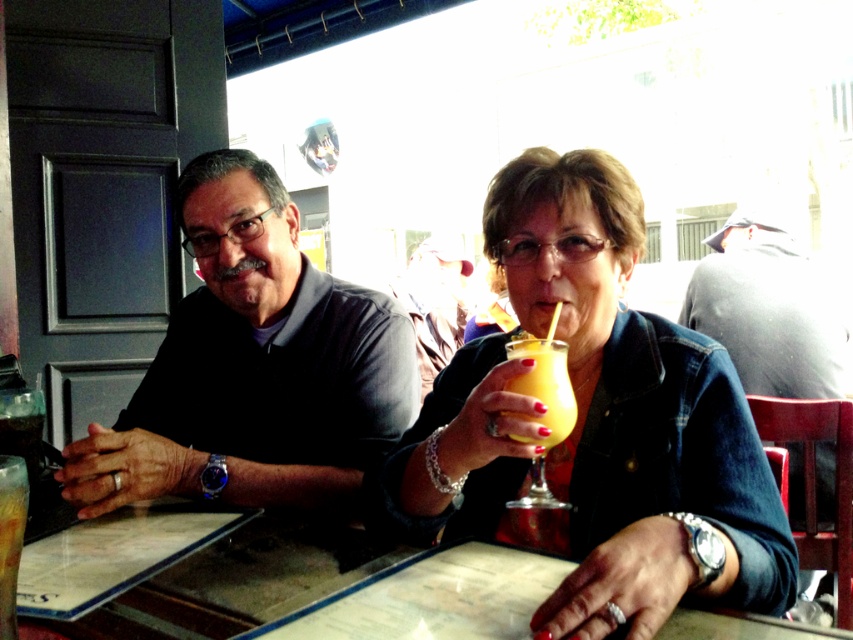
Question: Is translucent glass at upper center smaller than translucent glass at table left?

Choices:
 (A) yes
 (B) no

Answer: (B)

Question: Can you confirm if matte orange glass at center is wider than dark gray shirt at left?

Choices:
 (A) no
 (B) yes

Answer: (A)

Question: Among these objects, which one is nearest to the camera?

Choices:
 (A) translucent glass at table left
 (B) matte orange glass at center
 (C) translucent glass at upper center

Answer: (A)

Question: Estimate the real-world distances between objects in this image. Which object is farther from the translucent glass at table left?

Choices:
 (A) matte orange glass at center
 (B) clear glass table at center

Answer: (A)

Question: Estimate the real-world distances between objects in this image. Which object is closer to the clear glass table at center?

Choices:
 (A) translucent glass at upper center
 (B) matte orange glass at center
 (C) dark gray shirt at left

Answer: (B)

Question: Does dark gray shirt at left appear under translucent glass at upper center?

Choices:
 (A) no
 (B) yes

Answer: (A)